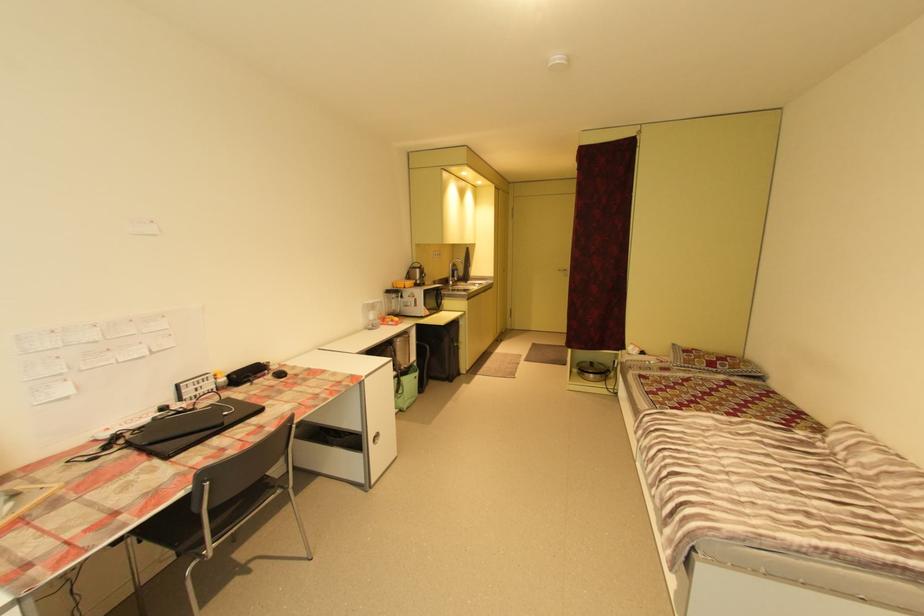
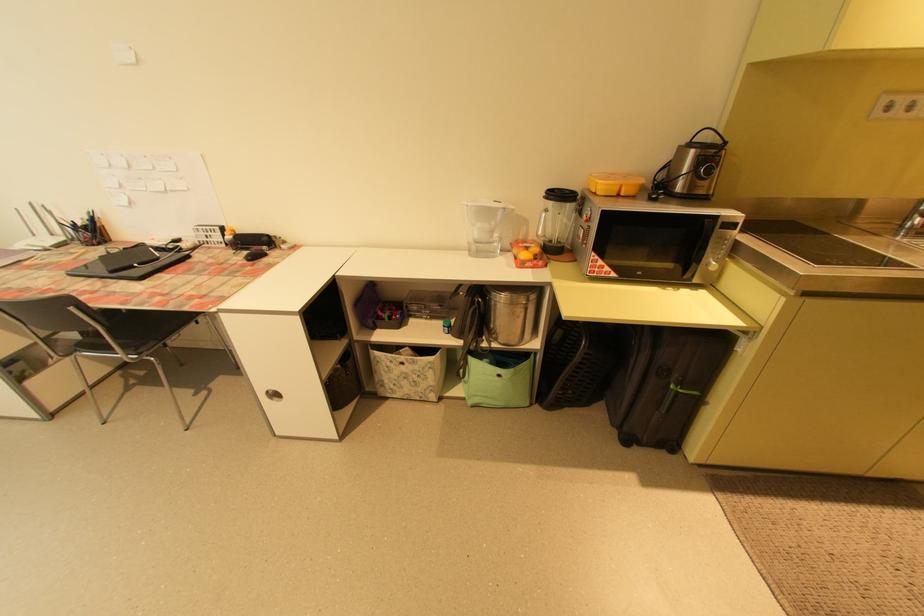
Where in the second image is the point corresponding to point 462,345 from the first image?

(678, 387)